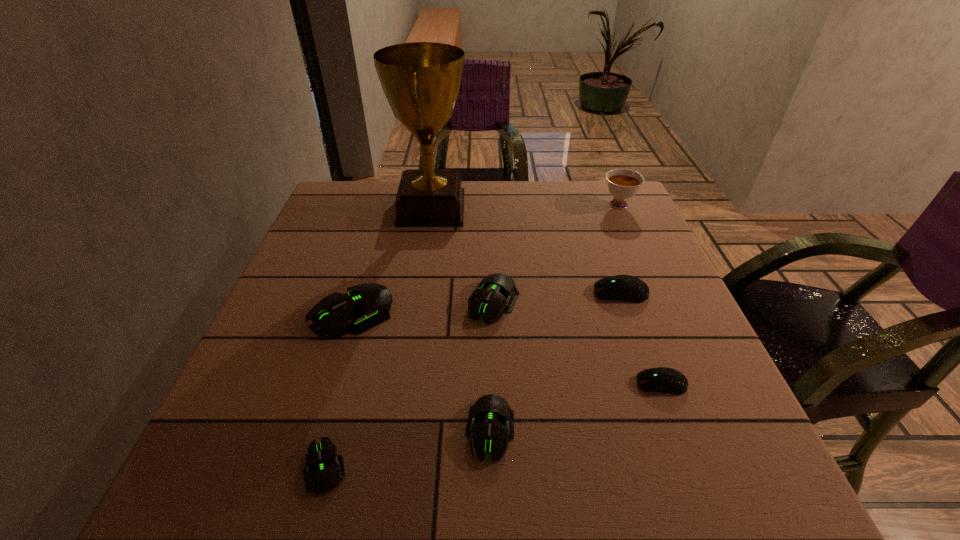
The height and width of the screenshot is (540, 960). I want to click on the smallest gray computer mouse, so click(323, 470).

Where is `the shortest object`? The image size is (960, 540). the shortest object is located at coordinates (323, 470).

This screenshot has width=960, height=540. Find the location of `free space located 0.230m on the plaque of the gold award`. free space located 0.230m on the plaque of the gold award is located at coordinates (550, 208).

Find the location of `vacant space situated 0.080m on the side of the white teacup with the handle`. vacant space situated 0.080m on the side of the white teacup with the handle is located at coordinates (608, 180).

The image size is (960, 540). I want to click on vacant space located on the side of the white teacup with the handle, so click(x=610, y=183).

Locate an element on the screen. The height and width of the screenshot is (540, 960). free space located 0.060m on the side of the white teacup with the handle is located at coordinates (610, 183).

You are a GUI agent. You are given a task and a screenshot of the screen. Output one action in this format:
    pyautogui.click(x=<x>, y=<y>)
    Task: Click on the free region located 0.300m on the front of the biggest gray computer mouse
    The width and height of the screenshot is (960, 540).
    Given the screenshot: What is the action you would take?
    point(297,498)

Find the location of a particular element. vacant region located on the button of the farther dark computer equipment is located at coordinates (567, 293).

Locate an element on the screen. This screenshot has height=540, width=960. free space located on the button of the farther dark computer equipment is located at coordinates click(x=468, y=293).

Identify the location of vacant area situated on the button of the farther dark computer equipment. The height and width of the screenshot is (540, 960). (508, 293).